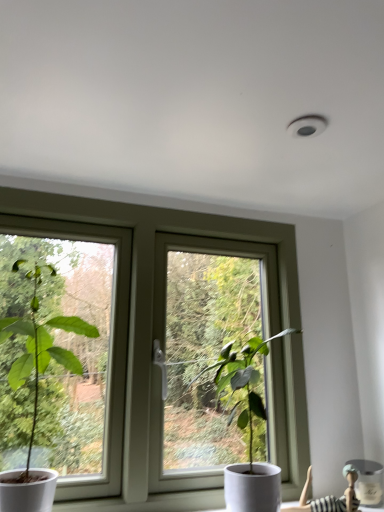
Question: Is striped fabric doll at lower right with white plastic window at center?

Choices:
 (A) no
 (B) yes

Answer: (A)

Question: Is striped fabric doll at lower right aimed at white plastic window at center?

Choices:
 (A) yes
 (B) no

Answer: (B)

Question: Can you confirm if striped fabric doll at lower right is bigger than white plastic window at center?

Choices:
 (A) no
 (B) yes

Answer: (A)

Question: Considering the relative positions of striped fabric doll at lower right and white plastic window at center in the image provided, is striped fabric doll at lower right to the right of white plastic window at center from the viewer's perspective?

Choices:
 (A) yes
 (B) no

Answer: (A)

Question: Is striped fabric doll at lower right shorter than white plastic window at center?

Choices:
 (A) yes
 (B) no

Answer: (A)

Question: From a real-world perspective, is striped fabric doll at lower right positioned over white plastic window at center based on gravity?

Choices:
 (A) yes
 (B) no

Answer: (B)

Question: Is white plastic window at center outside green matte plant at left, which is the 1th houseplant in left-to-right order?

Choices:
 (A) yes
 (B) no

Answer: (A)

Question: Can green matte plant at left, which is the 1th houseplant in left-to-right order, be found inside white plastic window at center?

Choices:
 (A) yes
 (B) no

Answer: (B)

Question: Is white plastic window at center aimed at green matte plant at left, which is the 1th houseplant in left-to-right order?

Choices:
 (A) no
 (B) yes

Answer: (B)

Question: Does white plastic window at center have a greater width compared to green matte plant at left, which is the 1th houseplant in left-to-right order?

Choices:
 (A) no
 (B) yes

Answer: (A)

Question: Considering the relative positions of white plastic window at center and green matte plant at left, which is the 1th houseplant in left-to-right order, in the image provided, is white plastic window at center to the left of green matte plant at left, which is the 1th houseplant in left-to-right order, from the viewer's perspective?

Choices:
 (A) yes
 (B) no

Answer: (B)

Question: Can you confirm if white plastic window at center is taller than green matte plant at left, the second houseplant in the right-to-left sequence?

Choices:
 (A) yes
 (B) no

Answer: (A)

Question: Is striped fabric doll at lower right completely or partially inside green matte plant at left, which is the 1th houseplant in left-to-right order?

Choices:
 (A) no
 (B) yes

Answer: (A)